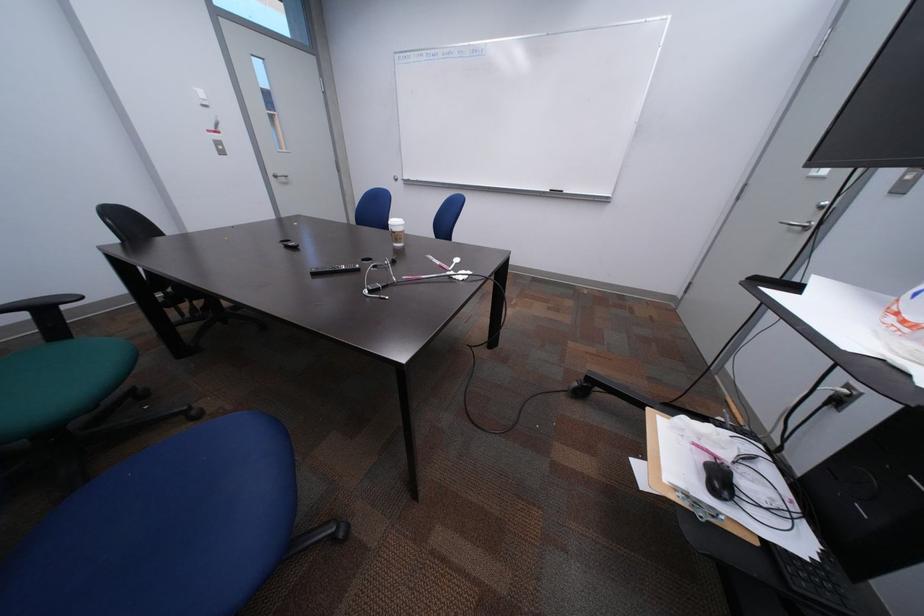
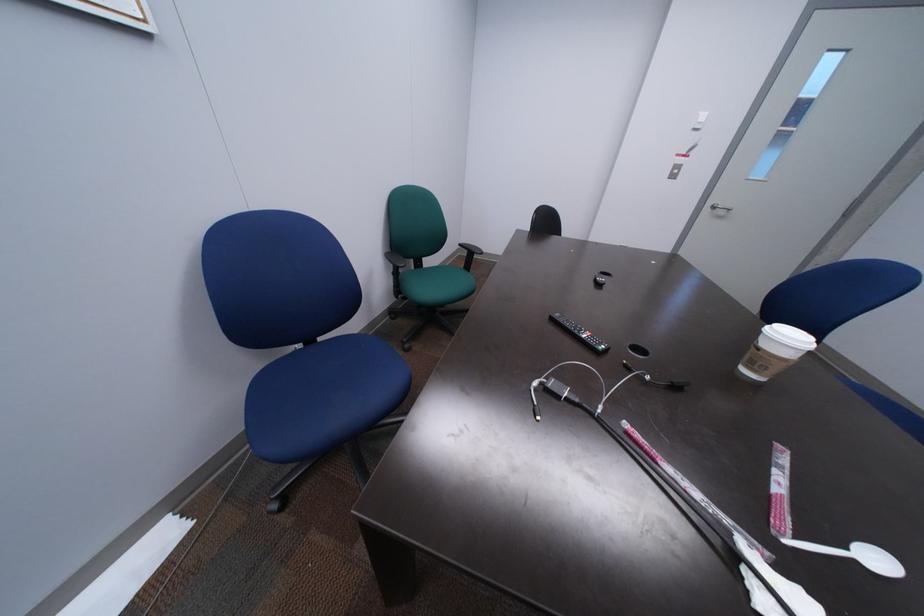
Consider the image. First-person continuous shooting, in which direction is the camera rotating?

The rotation direction of the camera is left-down.